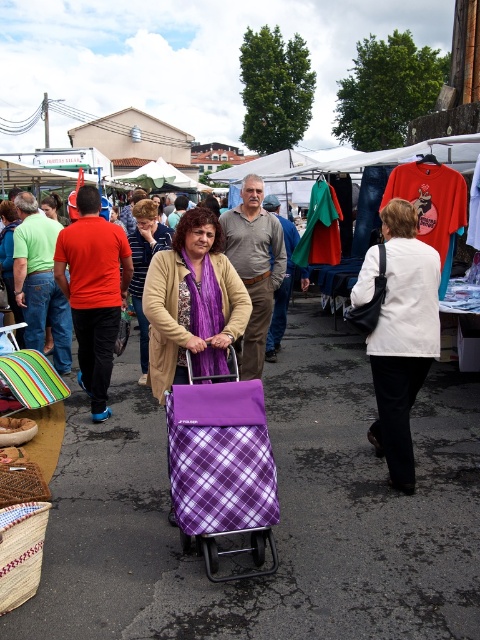
Does white matte jacket at center have a larger size compared to purple plaid shopping cart at center?

Incorrect, white matte jacket at center is not larger than purple plaid shopping cart at center.

Is white matte jacket at center below purple plaid shopping cart at center?

Yes.

Find the location of a particular element. The height and width of the screenshot is (640, 480). white matte jacket at center is located at coordinates (403, 337).

Between white matte jacket at center and purple plaid cart at center, which one appears on the left side from the viewer's perspective?

purple plaid cart at center is more to the left.

What are the coordinates of `white matte jacket at center` in the screenshot? It's located at (403, 337).

Can you confirm if purple plaid bag at center is shorter than purple plaid shopping cart at center?

Correct, purple plaid bag at center is not as tall as purple plaid shopping cart at center.

Which is behind, point (149, 324) or point (157, 244)?

The point (157, 244) is more distant.

You are a GUI agent. You are given a task and a screenshot of the screen. Output one action in this format:
    pyautogui.click(x=<x>, y=<y>)
    Task: Click on the purple plaid bag at center
    The height and width of the screenshot is (640, 480).
    Given the screenshot: What is the action you would take?
    pyautogui.click(x=192, y=300)